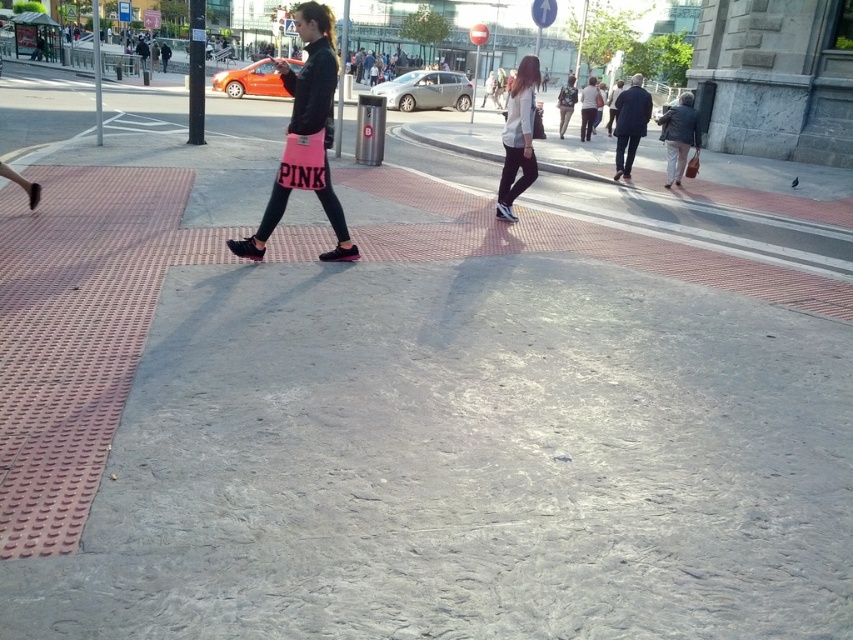
Question: Is pink fabric skirt at center further to the viewer compared to white matte shirt at center?

Choices:
 (A) no
 (B) yes

Answer: (A)

Question: Which object is farther from the camera taking this photo?

Choices:
 (A) pink fabric skirt at center
 (B) white matte shirt at center
 (C) brown leather jacket at right

Answer: (C)

Question: Is pink fabric skirt at center positioned behind brown leather jacket at right?

Choices:
 (A) yes
 (B) no

Answer: (B)

Question: Which object appears farthest from the camera in this image?

Choices:
 (A) dark blue suit at center
 (B) brown leather jacket at right
 (C) pink fabric skirt at center

Answer: (A)

Question: Can you confirm if pink fabric skirt at center is smaller than brown leather jacket at right?

Choices:
 (A) yes
 (B) no

Answer: (A)

Question: Among these points, which one is farthest from the camera?

Choices:
 (A) (639, 83)
 (B) (334, 58)
 (C) (514, 120)
 (D) (682, 152)

Answer: (A)